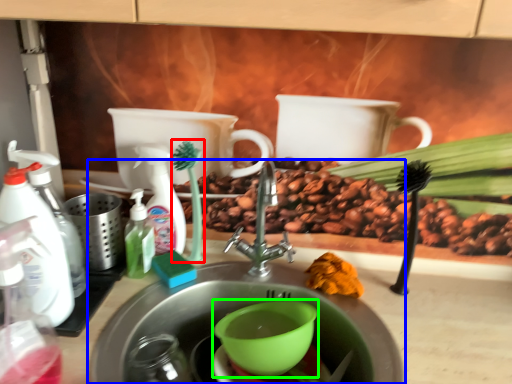
Question: Considering the real-world distances, which object is farthest from plant (highlighted by a red box)? sink (highlighted by a blue box) or mixing bowl (highlighted by a green box)?

Choices:
 (A) sink
 (B) mixing bowl

Answer: (B)